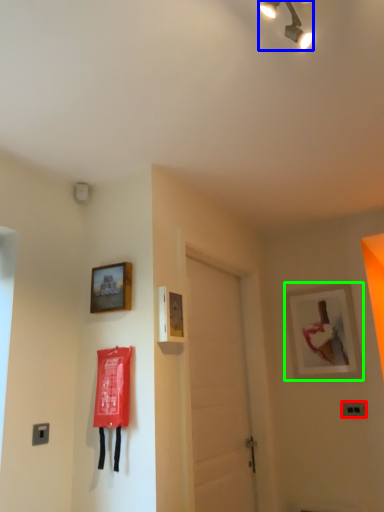
Question: Based on their relative distances, which object is farther from light switch (highlighted by a red box)? Choose from lamp (highlighted by a blue box) and picture frame (highlighted by a green box).

Choices:
 (A) lamp
 (B) picture frame

Answer: (A)